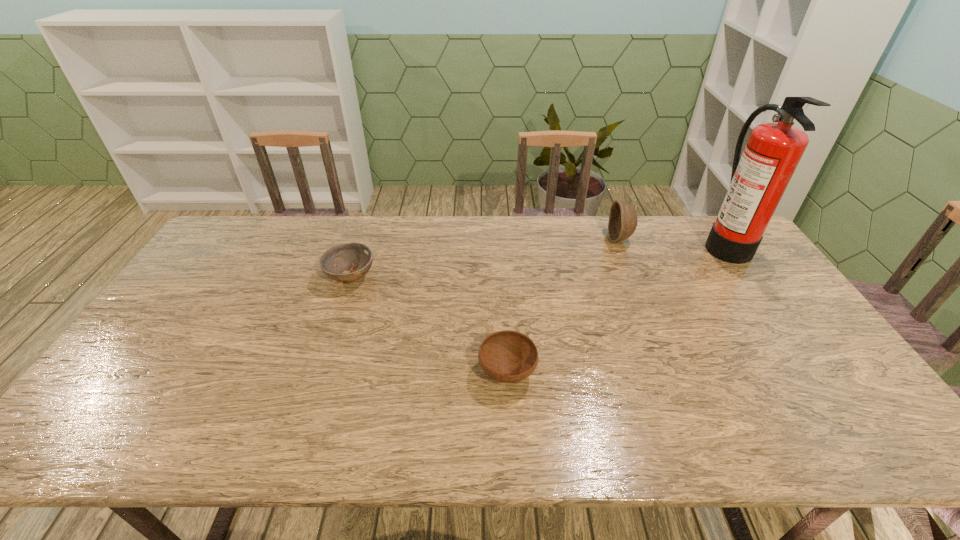
Where is `vacant region located on the front-facing side of the fire extinguisher`? This screenshot has height=540, width=960. vacant region located on the front-facing side of the fire extinguisher is located at coordinates point(660,244).

What are the coordinates of `vacant area situated 0.210m on the right of the tallest bowl` in the screenshot? It's located at (690, 239).

The height and width of the screenshot is (540, 960). Find the location of `vacant area situated 0.400m on the right of the leftmost bowl`. vacant area situated 0.400m on the right of the leftmost bowl is located at coordinates (502, 277).

This screenshot has width=960, height=540. Find the location of `vacant region located 0.080m on the left of the second bowl from left to right`. vacant region located 0.080m on the left of the second bowl from left to right is located at coordinates (446, 372).

Identify the location of fire extinguisher that is at the far edge. (759, 179).

The width and height of the screenshot is (960, 540). I want to click on bowl that is at the far edge, so click(623, 219).

Locate an element on the screen. This screenshot has height=540, width=960. object present at the right edge is located at coordinates (759, 179).

Find the location of a particular element. Image resolution: width=960 pixels, height=540 pixels. object located at the far right corner is located at coordinates (759, 179).

Find the location of a particular element. The width and height of the screenshot is (960, 540). vacant space at the far edge is located at coordinates (342, 230).

In the image, there is a desktop. Where is `vacant space at the near edge`? vacant space at the near edge is located at coordinates (285, 430).